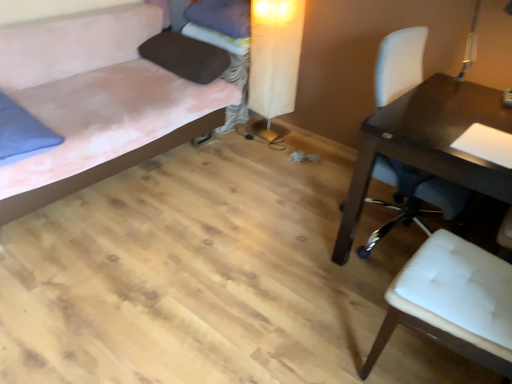
Question: Which direction should I rotate to look at brown fabric pillow at upper center, the 2th pillow positioned from the top, — up or down?

Choices:
 (A) up
 (B) down

Answer: (A)

Question: Is white leather chair at right, the 1th chair viewed from the back, taller than blue fabric pillow at left, marked as the 3th pillow in a top-to-bottom arrangement?

Choices:
 (A) no
 (B) yes

Answer: (B)

Question: Is white leather chair at right, which ranks as the second chair in front-to-back order, next to blue fabric pillow at left, the first pillow in the bottom-to-top sequence, and touching it?

Choices:
 (A) yes
 (B) no

Answer: (B)

Question: Does white leather chair at right, which ranks as the second chair in front-to-back order, have a greater width compared to blue fabric pillow at left, the first pillow in the bottom-to-top sequence?

Choices:
 (A) no
 (B) yes

Answer: (A)

Question: Does white leather chair at right, the 1th chair viewed from the back, have a larger size compared to blue fabric pillow at left, the first pillow in the bottom-to-top sequence?

Choices:
 (A) no
 (B) yes

Answer: (B)

Question: Is blue fabric pillow at left, marked as the 3th pillow in a top-to-bottom arrangement, a part of white leather chair at right, the 1th chair viewed from the back?

Choices:
 (A) yes
 (B) no

Answer: (B)

Question: Is white leather chair at right, which ranks as the second chair in front-to-back order, aimed at blue fabric pillow at left, the first pillow in the bottom-to-top sequence?

Choices:
 (A) no
 (B) yes

Answer: (A)

Question: Is purple fabric pillow at upper center, the 3th pillow positioned from the bottom, bigger than brown fabric pillow at upper center, the 2th pillow positioned from the top?

Choices:
 (A) no
 (B) yes

Answer: (A)

Question: Is purple fabric pillow at upper center, the 3th pillow positioned from the bottom, shorter than brown fabric pillow at upper center, the 2th pillow positioned from the top?

Choices:
 (A) no
 (B) yes

Answer: (A)

Question: Considering the relative positions of purple fabric pillow at upper center, the 3th pillow positioned from the bottom, and brown fabric pillow at upper center, the 2th pillow positioned from the top, in the image provided, is purple fabric pillow at upper center, the 3th pillow positioned from the bottom, to the left of brown fabric pillow at upper center, the 2th pillow positioned from the top, from the viewer's perspective?

Choices:
 (A) no
 (B) yes

Answer: (A)

Question: From a real-world perspective, does purple fabric pillow at upper center, placed as the 1th pillow when sorted from top to bottom, stand above brown fabric pillow at upper center, the second pillow positioned from the bottom?

Choices:
 (A) yes
 (B) no

Answer: (A)

Question: From the image's perspective, is purple fabric pillow at upper center, the 3th pillow positioned from the bottom, over brown fabric pillow at upper center, the 2th pillow positioned from the top?

Choices:
 (A) no
 (B) yes

Answer: (B)

Question: Is purple fabric pillow at upper center, placed as the 1th pillow when sorted from top to bottom, closer to the viewer compared to brown fabric pillow at upper center, the second pillow positioned from the bottom?

Choices:
 (A) yes
 (B) no

Answer: (B)

Question: Can you confirm if white leather chair at right, the 1th chair viewed from the back, is positioned to the right of brown fabric pillow at upper center, the 2th pillow positioned from the top?

Choices:
 (A) no
 (B) yes

Answer: (B)